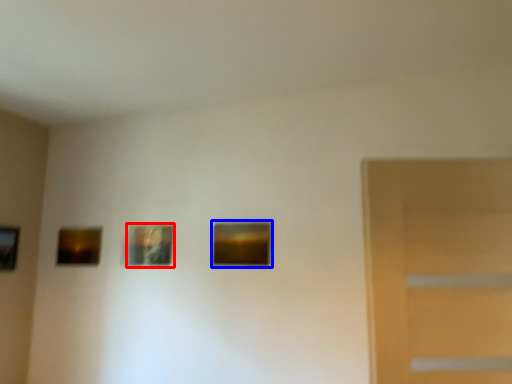
Question: Which of the following is the closest to the observer, picture frame (highlighted by a red box) or picture frame (highlighted by a blue box)?

Choices:
 (A) picture frame
 (B) picture frame

Answer: (B)